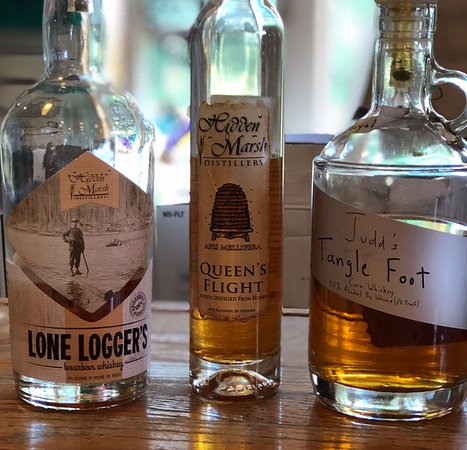
This screenshot has width=467, height=450. Find the location of `glass bottle`. glass bottle is located at coordinates (99, 144), (244, 80), (415, 141).